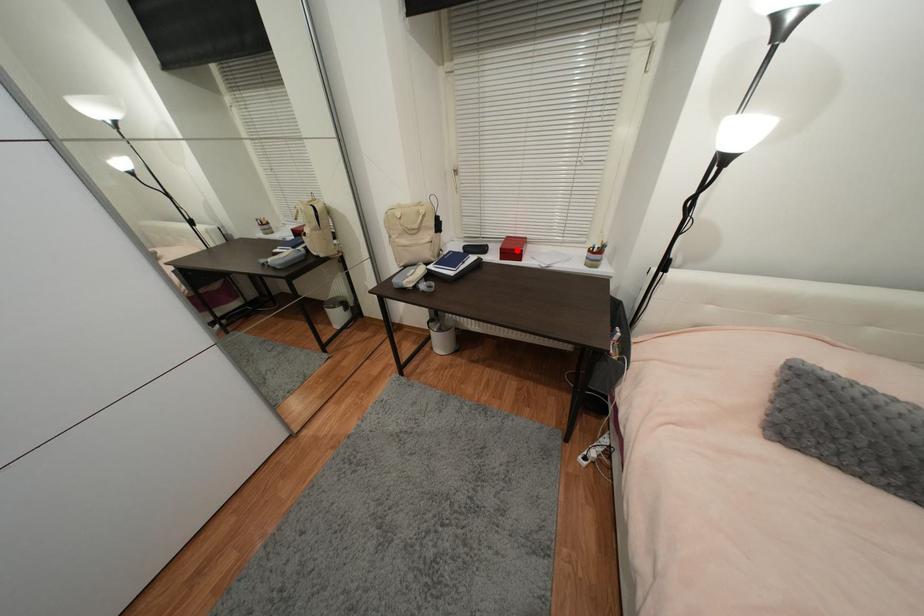
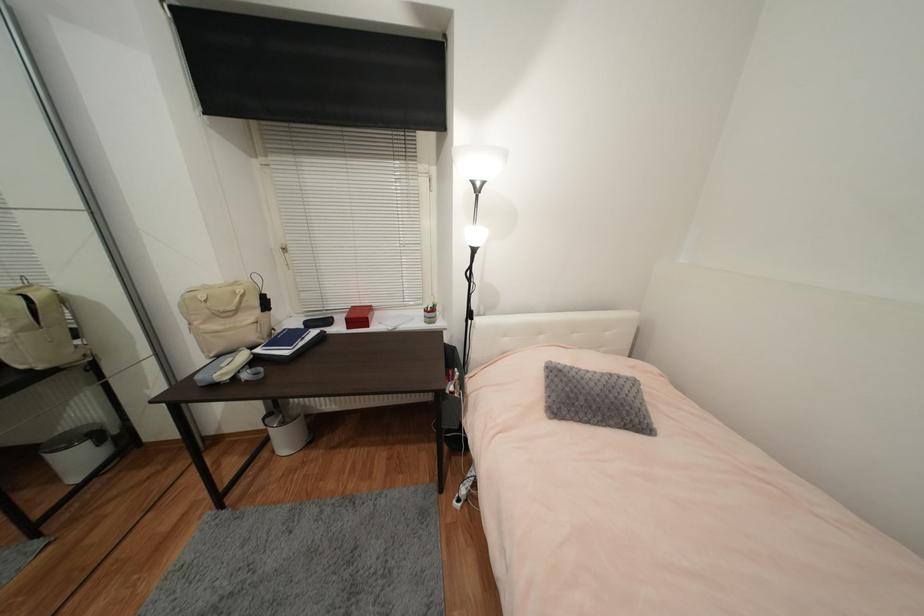
Locate, in the second image, the point that corresponds to the highlighted location in the first image.

(363, 318)